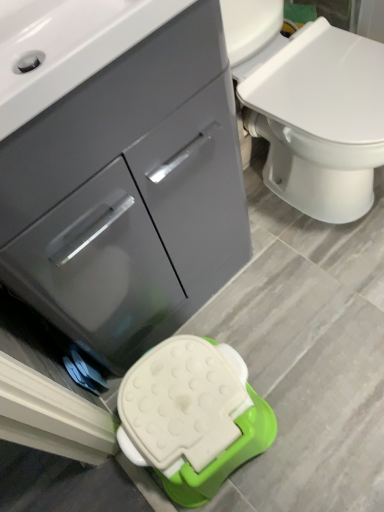
Question: Is matte gray cabinet at center positioned with its back to white plastic stool at lower center?

Choices:
 (A) yes
 (B) no

Answer: (B)

Question: Considering the relative positions of matte gray cabinet at center and white plastic stool at lower center in the image provided, is matte gray cabinet at center to the right of white plastic stool at lower center from the viewer's perspective?

Choices:
 (A) no
 (B) yes

Answer: (A)

Question: From the image's perspective, is matte gray cabinet at center located beneath white plastic stool at lower center?

Choices:
 (A) yes
 (B) no

Answer: (B)

Question: Could white plastic stool at lower center be considered to be inside matte gray cabinet at center?

Choices:
 (A) no
 (B) yes

Answer: (A)

Question: Is matte gray cabinet at center oriented towards white plastic stool at lower center?

Choices:
 (A) yes
 (B) no

Answer: (A)

Question: Considering the relative positions of matte gray cabinet at center and white plastic stool at lower center in the image provided, is matte gray cabinet at center to the left of white plastic stool at lower center from the viewer's perspective?

Choices:
 (A) yes
 (B) no

Answer: (A)

Question: Is white plastic stool at lower center outside of matte gray cabinet at center?

Choices:
 (A) yes
 (B) no

Answer: (A)

Question: Can you confirm if white plastic stool at lower center is positioned to the left of matte gray cabinet at center?

Choices:
 (A) no
 (B) yes

Answer: (A)

Question: Is white plastic stool at lower center not near matte gray cabinet at center?

Choices:
 (A) no
 (B) yes

Answer: (A)

Question: From a real-world perspective, is white plastic stool at lower center located beneath matte gray cabinet at center?

Choices:
 (A) yes
 (B) no

Answer: (A)

Question: Is the position of white plastic stool at lower center less distant than that of matte gray cabinet at center?

Choices:
 (A) no
 (B) yes

Answer: (A)

Question: Is white plastic stool at lower center oriented away from matte gray cabinet at center?

Choices:
 (A) no
 (B) yes

Answer: (B)

Question: Does white glossy sink at upper left have a greater width compared to white plastic stool at lower center?

Choices:
 (A) no
 (B) yes

Answer: (B)